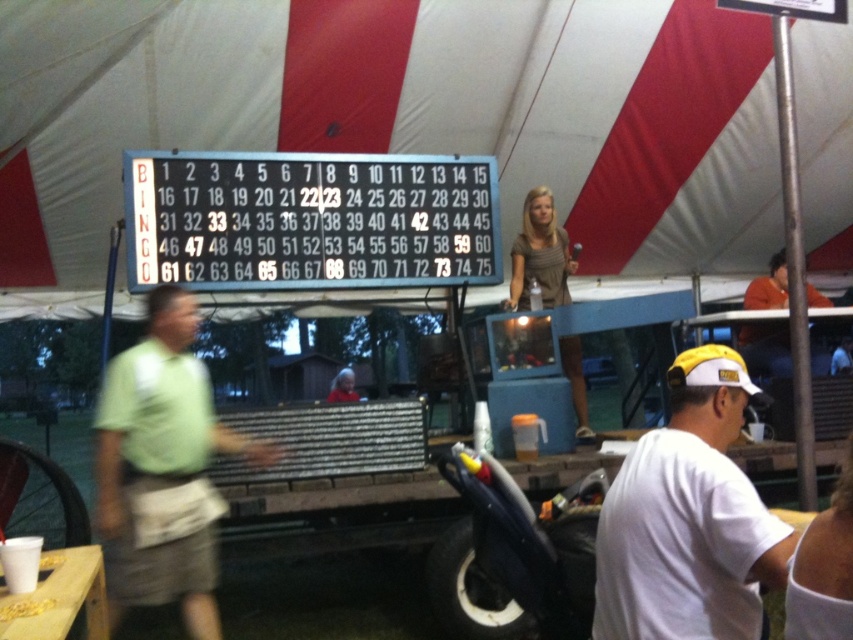
Can you confirm if white cotton shirt at lower right is shorter than matte gray dress at center?

No.

Between point (680, 483) and point (541, 275), which one is positioned in front?

Point (680, 483) is in front.

Image resolution: width=853 pixels, height=640 pixels. Find the location of `white cotton shirt at lower right`. white cotton shirt at lower right is located at coordinates (688, 518).

Is point (204, 442) positioned behind point (567, 257)?

No, it is in front of (567, 257).

Who is positioned more to the right, green fabric shirt at left or matte gray dress at center?

matte gray dress at center

Image resolution: width=853 pixels, height=640 pixels. I want to click on green fabric shirt at left, so click(x=161, y=468).

In order to click on green fabric shirt at left in this screenshot , I will do `click(161, 468)`.

Who is more distant from viewer, (161,230) or (543,269)?

Point (543,269)

Is point (160, 266) farther from viewer compared to point (585, 420)?

No, it is not.

This screenshot has height=640, width=853. In order to click on blue plastic scoreboard at center in this screenshot , I will do `click(309, 220)`.

Find the location of a particular element. This screenshot has height=640, width=853. blue plastic scoreboard at center is located at coordinates (309, 220).